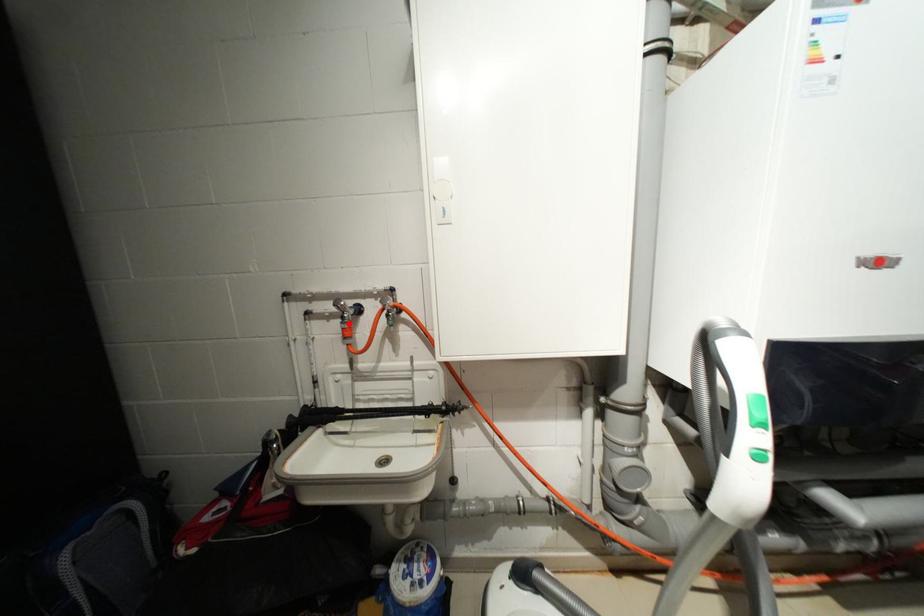
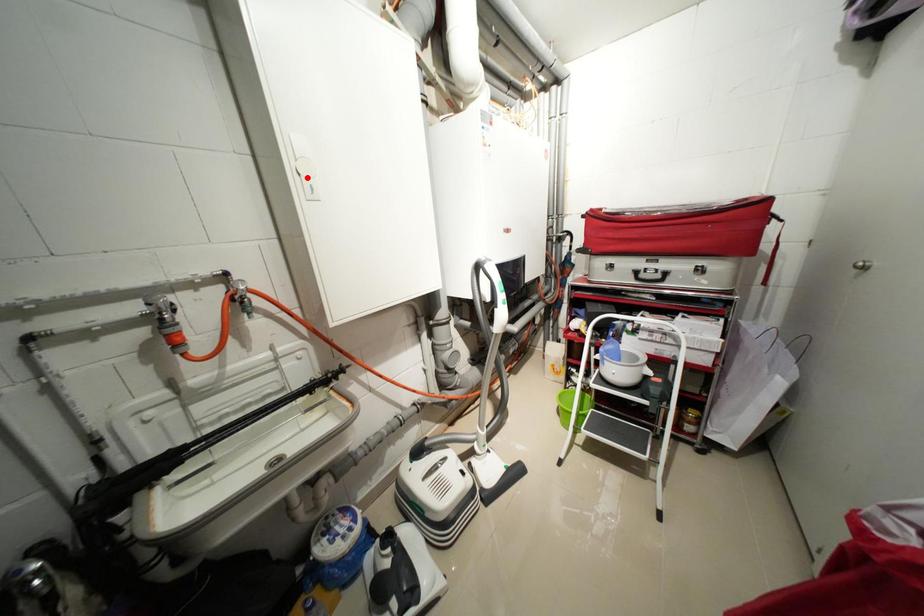
I am providing you with two images of the same scene from different viewpoints. A red point is marked on the first image and another point is marked on the second image. Do the highlighted points in image1 and image2 indicate the same real-world spot?

No